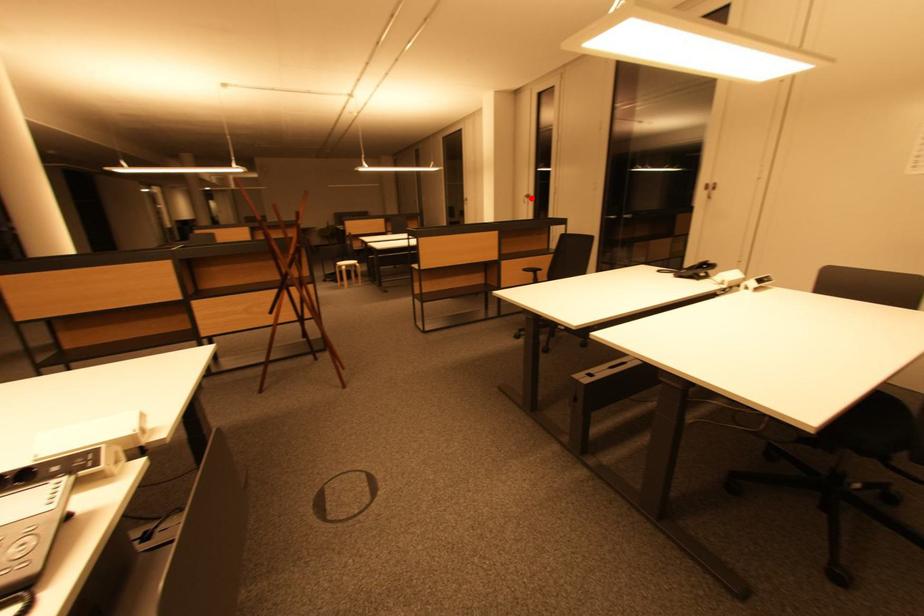
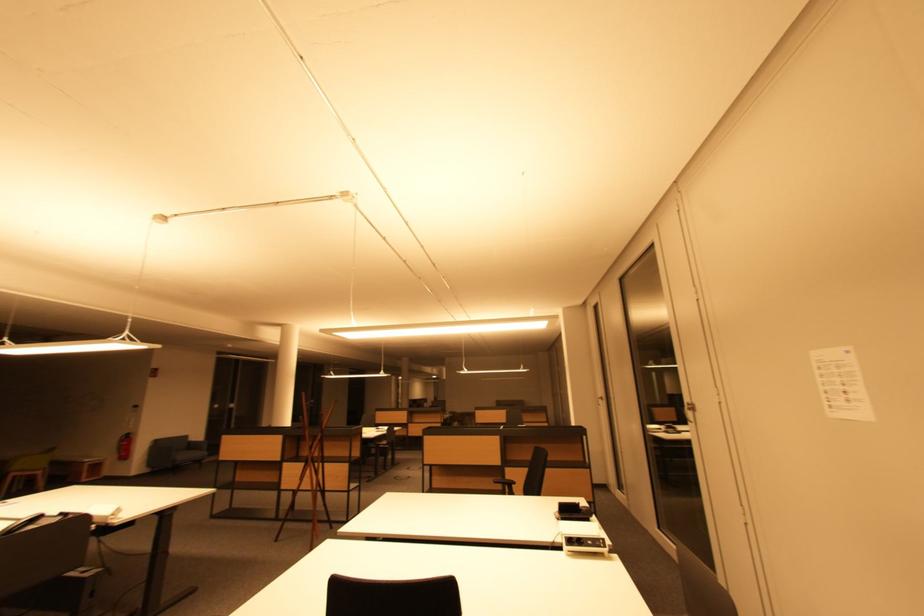
The point at the highlighted location is marked in the first image. Where is the corresponding point in the second image?

(605, 400)